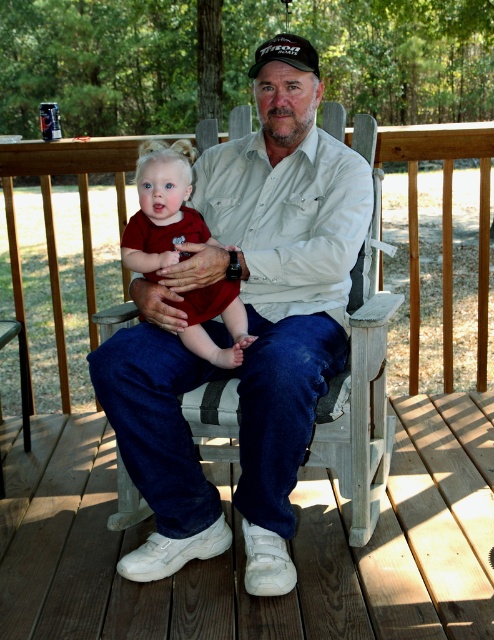
You are standing on the wooden deck and want to place a small potted plant between the two points, point (300,358) and point (441,604). Which point should the plant be closer to in order to be closer to the viewer?

The plant should be closer to point (300,358) because it is closer to the viewer than point (441,604).

You are a photographer setting up a shoot on the deck. You have a matte red dress at center and a black fabric baseball cap at center. You need to place a backdrop behind the wider object. Which object should you place the backdrop behind?

The matte red dress at center is wider than the black fabric baseball cap at center, so you should place the backdrop behind the matte red dress at center.

Looking at this image, you are a photographer standing at the camera position. You want to capture a closeup shot of the matte red dress at center. The camera has a minimum focusing distance of 2 meters. Can you take the photo without moving the dress or yourself?

The matte red dress at center is 2.35 meters away from camera. Since the minimum focusing distance is 2 meters, the camera can focus on the matte red dress at center as it is beyond the minimum distance required.